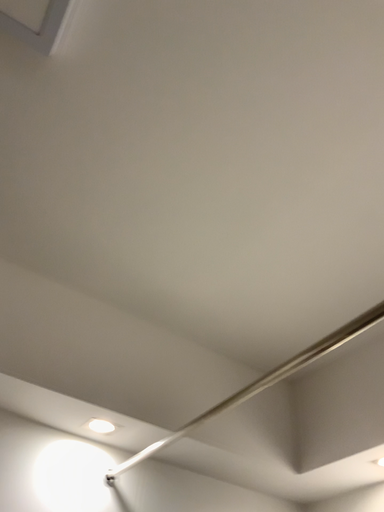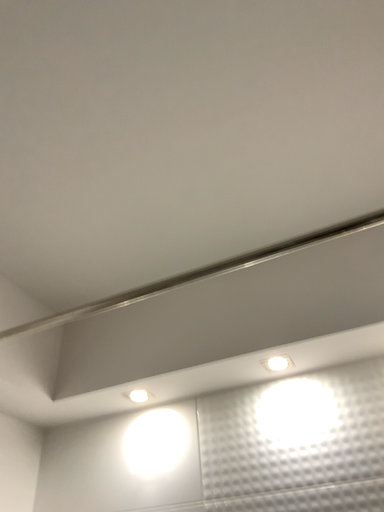
Question: How did the camera likely rotate when shooting the video?

Choices:
 (A) rotated downward
 (B) rotated upward

Answer: (A)